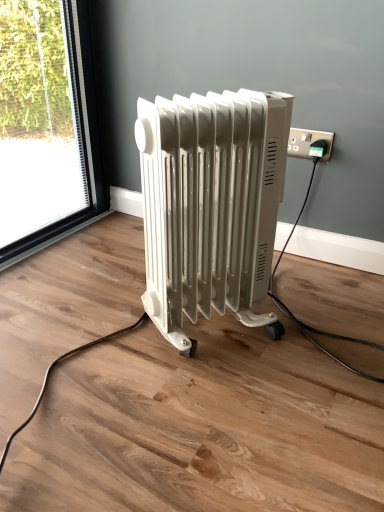
This screenshot has width=384, height=512. In order to click on free point below white glossy radiator at center (from a real-world perspective) in this screenshot , I will do pos(215,343).